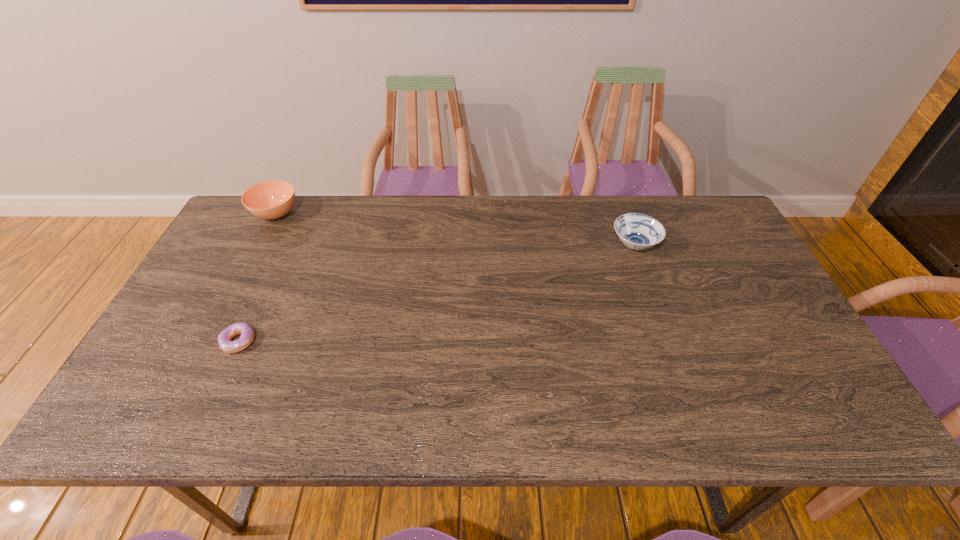
The image size is (960, 540). In order to click on doughnut at the left edge in this screenshot , I will do `click(247, 334)`.

The width and height of the screenshot is (960, 540). What are the coordinates of `object positioned at the far left corner` in the screenshot? It's located at (272, 199).

In the image, there is a desktop. Where is `vacant area at the far edge`? The height and width of the screenshot is (540, 960). vacant area at the far edge is located at coordinates (606, 238).

At what (x,y) coordinates should I click in order to perform the action: click on blank area at the near edge. Please return your answer as a coordinate pair (x, y). Looking at the image, I should click on (694, 416).

I want to click on vacant space at the right edge of the desktop, so click(x=709, y=285).

Identify the location of vacant space at the far right corner of the desktop. The height and width of the screenshot is (540, 960). (702, 205).

Where is `vacant space at the near right corner`? This screenshot has height=540, width=960. vacant space at the near right corner is located at coordinates (848, 423).

Identify the location of empty space that is in between the farther soup bowl and the nearest object. (257, 278).

Locate an element on the screen. The height and width of the screenshot is (540, 960). free space between the second tallest object and the farther soup bowl is located at coordinates (455, 230).

Locate an element on the screen. vacant area that lies between the left soup bowl and the second tallest object is located at coordinates (455, 230).